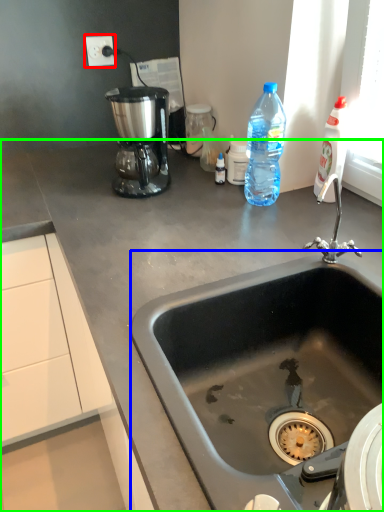
Question: Considering the real-world distances, which object is closest to electric outlet (highlighted by a red box)? sink (highlighted by a blue box) or countertop (highlighted by a green box).

Choices:
 (A) sink
 (B) countertop

Answer: (B)